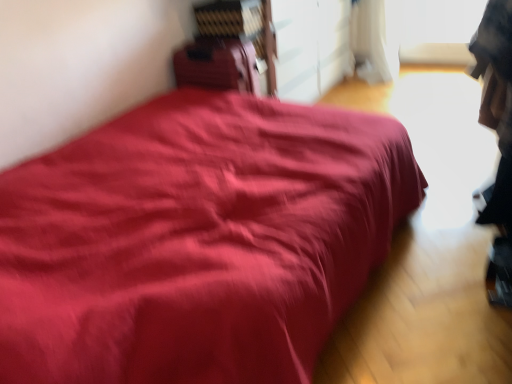
Describe the element at coordinates (196, 241) in the screenshot. The width and height of the screenshot is (512, 384). I see `matte red bed at center` at that location.

Find the location of a particular element. The width and height of the screenshot is (512, 384). matte red bed at center is located at coordinates (196, 241).

What is the approximate height of matte red bed at center?

0.92 inches.

Describe the element at coordinates (217, 65) in the screenshot. I see `matte red suitcase at center` at that location.

You are a GUI agent. You are given a task and a screenshot of the screen. Output one action in this format:
    pyautogui.click(x=<x>, y=<y>)
    Task: Click on the matte red suitcase at center
    This screenshot has height=384, width=512.
    Given the screenshot: What is the action you would take?
    pyautogui.click(x=217, y=65)

Locate an element on the screen. matte red bed at center is located at coordinates (196, 241).

Is matte red suitcase at center at the left side of matte red bed at center?

Yes.

Is matte red suitcase at center closer to camera compared to matte red bed at center?

No, matte red suitcase at center is further to the viewer.

Considering the positions of point (203, 78) and point (265, 329), is point (203, 78) closer or farther from the camera than point (265, 329)?

Point (203, 78) appears to be farther away from the viewer than point (265, 329).

From the image's perspective, is matte red suitcase at center beneath matte red bed at center?

No, from the image's perspective, matte red suitcase at center is not below matte red bed at center.

From a real-world perspective, is matte red suitcase at center above or below matte red bed at center?

matte red suitcase at center is situated higher than matte red bed at center in the real world.

In the scene shown: Considering the sizes of matte red suitcase at center and matte red bed at center in the image, is matte red suitcase at center wider or thinner than matte red bed at center?

Considering their sizes, matte red suitcase at center looks slimmer than matte red bed at center.

Considering the sizes of objects matte red suitcase at center and matte red bed at center in the image provided, who is taller, matte red suitcase at center or matte red bed at center?

matte red suitcase at center.

Who is bigger, matte red suitcase at center or matte red bed at center?

matte red bed at center is bigger.

Based on the photo, is matte red bed at center a part of matte red suitcase at center?

No.

Are matte red suitcase at center and matte red bed at center beside each other?

No, matte red suitcase at center is not beside matte red bed at center.

Is matte red suitcase at center oriented towards matte red bed at center?

No.

This screenshot has height=384, width=512. Find the location of `luggage on the left of the matte red bed at center`. luggage on the left of the matte red bed at center is located at coordinates [x=217, y=65].

Is matte red bed at center at the left side of matte red suitcase at center?

No, matte red bed at center is not to the left of matte red suitcase at center.

Which is in front, matte red bed at center or matte red suitcase at center?

matte red bed at center is in front.

Is point (256, 150) farther from camera compared to point (207, 44)?

No, (256, 150) is closer to viewer.

From the image's perspective, is matte red bed at center under matte red suitcase at center?

Yes, from the image's perspective, matte red bed at center is beneath matte red suitcase at center.

Consider the image. From a real-world perspective, is matte red bed at center above or below matte red suitcase at center?

matte red bed at center is below matte red suitcase at center.

Considering the relative sizes of matte red bed at center and matte red suitcase at center in the image provided, is matte red bed at center thinner than matte red suitcase at center?

In fact, matte red bed at center might be wider than matte red suitcase at center.

Between matte red bed at center and matte red suitcase at center, which one has more height?

Standing taller between the two is matte red suitcase at center.

In terms of size, does matte red bed at center appear bigger or smaller than matte red suitcase at center?

Considering their sizes, matte red bed at center takes up more space than matte red suitcase at center.

Is matte red bed at center inside or outside of matte red suitcase at center?

matte red bed at center lies outside matte red suitcase at center.

Is matte red bed at center not near matte red suitcase at center?

No, matte red bed at center is in close proximity to matte red suitcase at center.

Is matte red bed at center looking in the opposite direction of matte red suitcase at center?

No, matte red suitcase at center is not at the back of matte red bed at center.

How many degrees apart are the facing directions of matte red bed at center and matte red suitcase at center?

There is a 89.3-degree angle between the facing directions of matte red bed at center and matte red suitcase at center.

Measure the distance between matte red bed at center and matte red suitcase at center.

matte red bed at center and matte red suitcase at center are 38.73 inches apart from each other.

Where is `bed in front of the matte red suitcase at center`? bed in front of the matte red suitcase at center is located at coordinates (196, 241).

At what (x,y) coordinates should I click in order to perform the action: click on luggage behind the matte red bed at center. Please return your answer as a coordinate pair (x, y). Looking at the image, I should click on (217, 65).

I want to click on bed on the right of matte red suitcase at center, so click(196, 241).